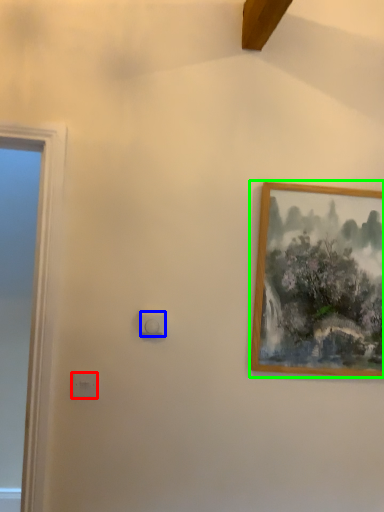
Question: Estimate the real-world distances between objects in this image. Which object is farther from light switch (highlighted by a red box), light switch (highlighted by a blue box) or picture frame (highlighted by a green box)?

Choices:
 (A) light switch
 (B) picture frame

Answer: (B)